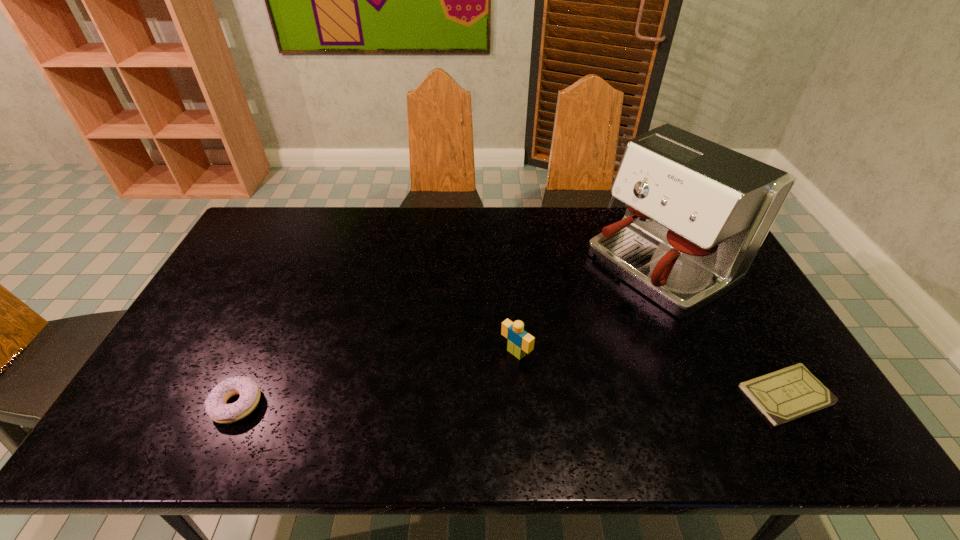
Locate an element on the screen. This screenshot has height=540, width=960. object located at the far right corner is located at coordinates (697, 213).

The width and height of the screenshot is (960, 540). In order to click on object at the near right corner in this screenshot , I will do `click(782, 396)`.

The height and width of the screenshot is (540, 960). I want to click on free space at the far edge of the desktop, so click(x=609, y=215).

Find the location of a particular element. The image size is (960, 540). free space at the near edge of the desktop is located at coordinates (561, 408).

Where is `blank space at the left edge of the desktop`? blank space at the left edge of the desktop is located at coordinates (212, 377).

In order to click on blank region between the second farthest object and the second shortest object in this screenshot , I will do `click(376, 379)`.

Identify the location of vacant space in between the second object from left to right and the leftmost object. The height and width of the screenshot is (540, 960). tap(376, 379).

Find the location of a particular element. The image size is (960, 540). unoccupied position between the checkbook and the third object from right to left is located at coordinates (651, 374).

Where is `free area in between the coffee maker and the checkbook`? This screenshot has width=960, height=540. free area in between the coffee maker and the checkbook is located at coordinates (722, 330).

The image size is (960, 540). I want to click on vacant area between the leftmost object and the second farthest object, so click(376, 379).